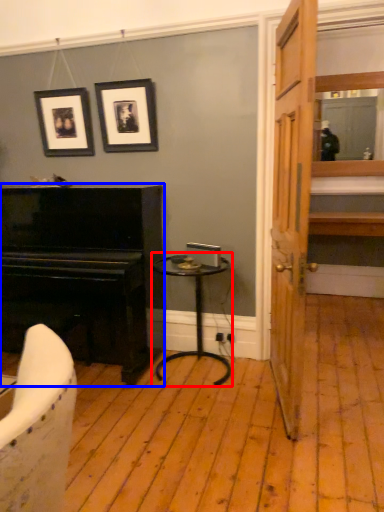
Question: Which object is further to the camera taking this photo, table (highlighted by a red box) or piano (highlighted by a blue box)?

Choices:
 (A) table
 (B) piano

Answer: (A)